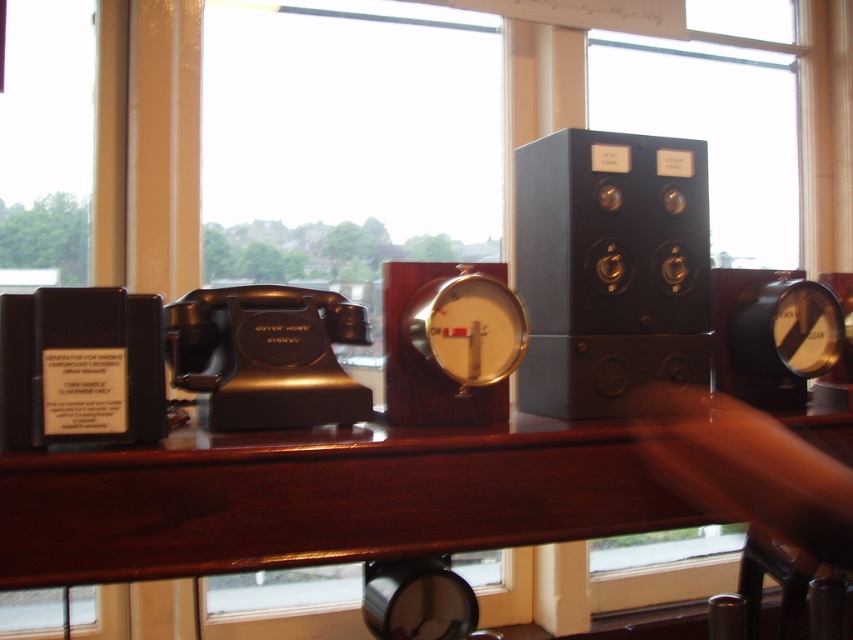
Question: Considering the relative positions of mahogany wood table at center and black matte speaker at center in the image provided, where is mahogany wood table at center located with respect to black matte speaker at center?

Choices:
 (A) above
 (B) below

Answer: (B)

Question: Which point is closer to the camera taking this photo?

Choices:
 (A) (74, 456)
 (B) (628, 141)

Answer: (A)

Question: Among these points, which one is nearest to the camera?

Choices:
 (A) (585, 406)
 (B) (569, 490)

Answer: (B)

Question: Is mahogany wood table at center below black matte speaker at center?

Choices:
 (A) no
 (B) yes

Answer: (B)

Question: Which point is closer to the camera?

Choices:
 (A) (563, 522)
 (B) (590, 380)

Answer: (A)

Question: Is mahogany wood table at center below black matte speaker at center?

Choices:
 (A) no
 (B) yes

Answer: (B)